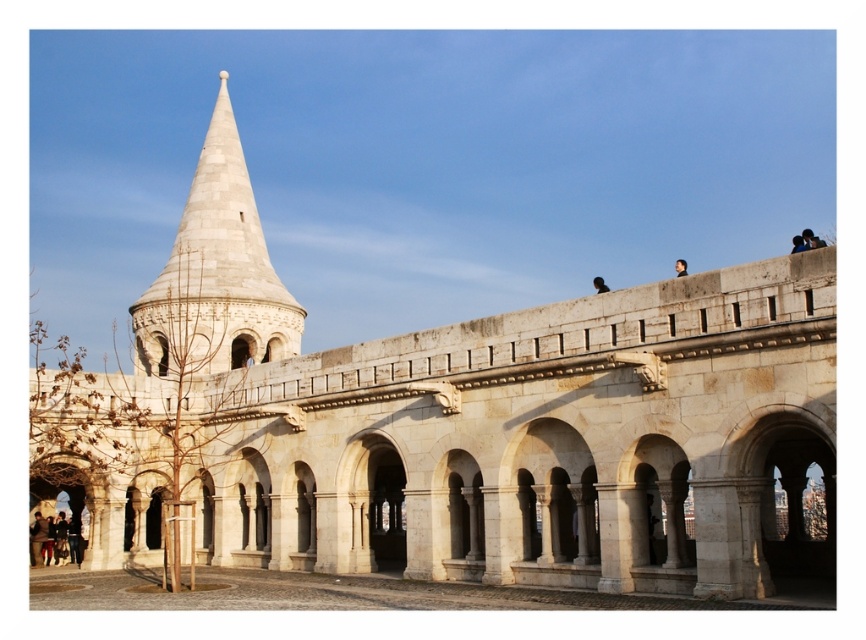
Question: Is black matte person at upper right positioned behind brown leather jacket at upper center?

Choices:
 (A) yes
 (B) no

Answer: (B)

Question: Which object appears farthest from the camera in this image?

Choices:
 (A) white stone tower at upper left
 (B) brown leather jacket at upper center
 (C) black matte person at upper right

Answer: (A)

Question: Which object appears closest to the camera in this image?

Choices:
 (A) black matte person at upper right
 (B) brown leather jacket at upper center
 (C) white stone tower at upper left

Answer: (A)

Question: Is white stone tower at upper left in front of brown leather jacket at upper center?

Choices:
 (A) yes
 (B) no

Answer: (B)

Question: Is white stone tower at upper left to the right of brown leather jacket at upper center from the viewer's perspective?

Choices:
 (A) no
 (B) yes

Answer: (A)

Question: Which of the following is the closest to the observer?

Choices:
 (A) (598, 280)
 (B) (679, 273)

Answer: (B)